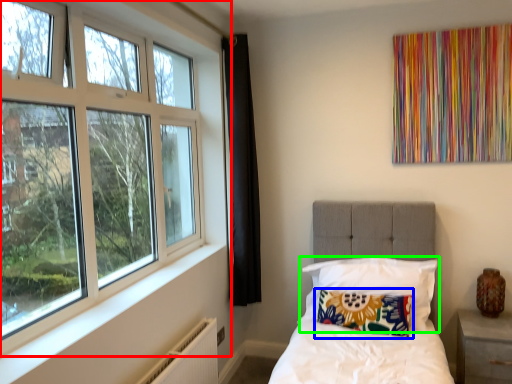
Question: Which object is the farthest from window (highlighted by a red box)? Choose among these: pillow (highlighted by a blue box) or pillow (highlighted by a green box).

Choices:
 (A) pillow
 (B) pillow

Answer: (A)